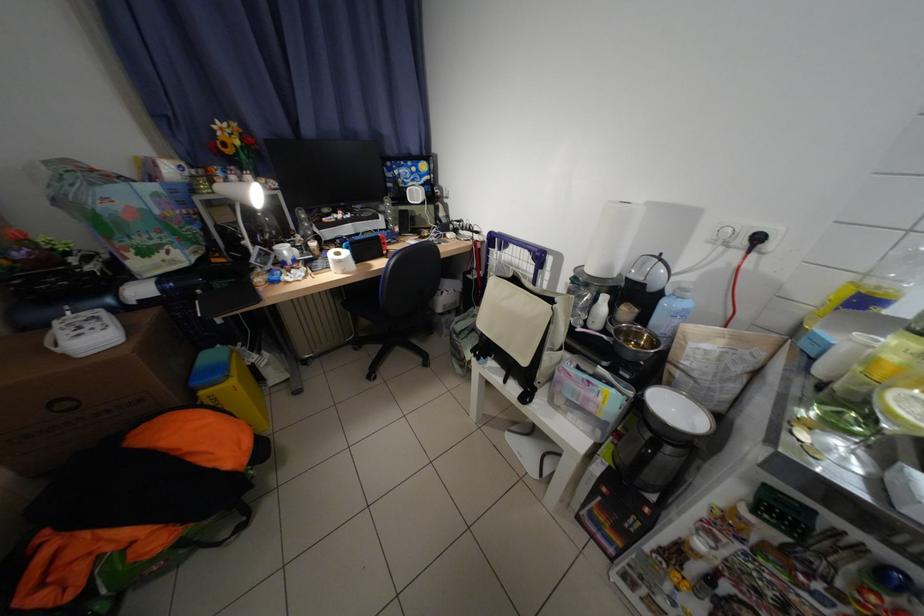
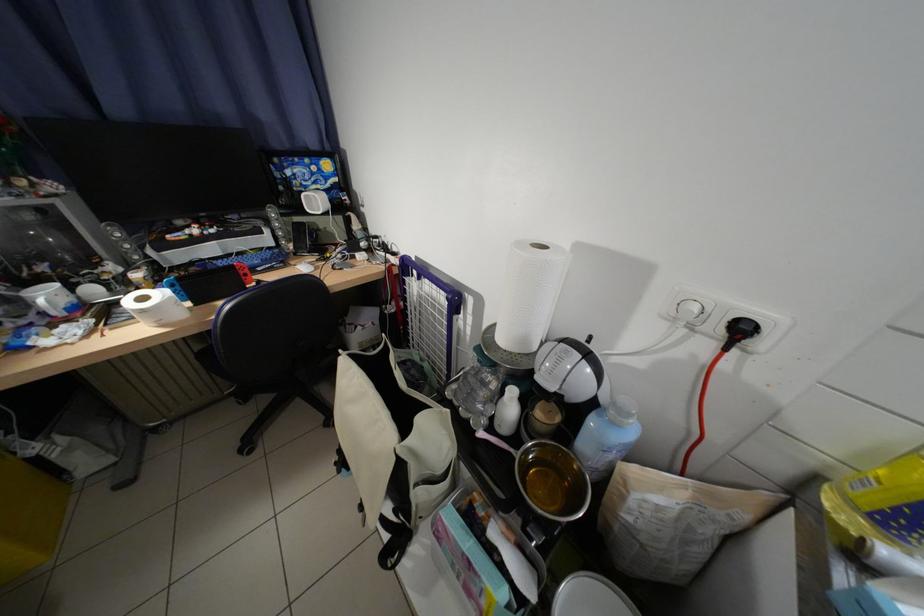
In the second image, find the point that corresponds to pixel 758 245 in the first image.

(734, 333)